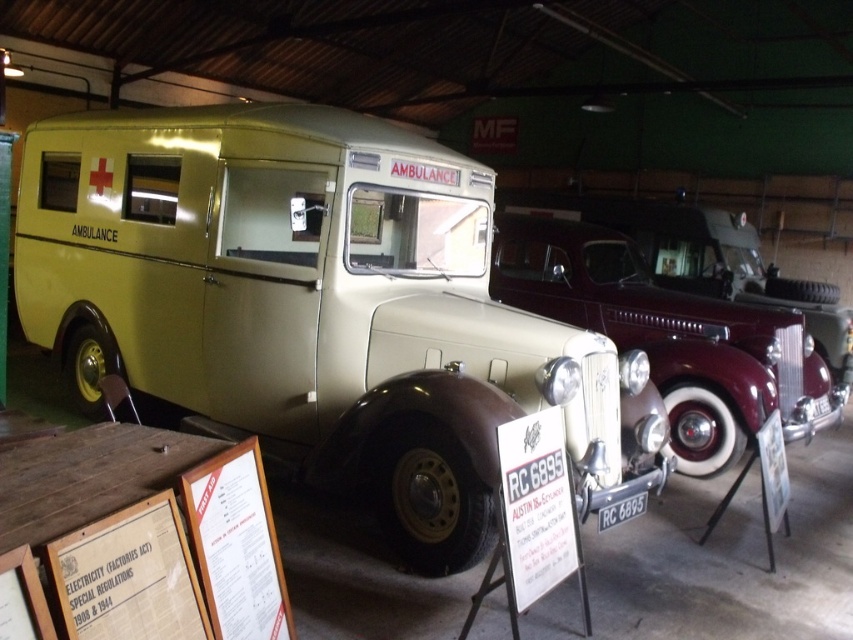
Question: Which of the following is the farthest from the observer?

Choices:
 (A) maroon glossy car at center
 (B) matte beige ambulance at center

Answer: (A)

Question: Does matte beige ambulance at center have a smaller size compared to maroon glossy car at center?

Choices:
 (A) no
 (B) yes

Answer: (A)

Question: Does matte beige ambulance at center appear under maroon glossy car at center?

Choices:
 (A) yes
 (B) no

Answer: (B)

Question: Does matte beige ambulance at center appear under maroon glossy car at center?

Choices:
 (A) yes
 (B) no

Answer: (B)

Question: Which object appears closest to the camera in this image?

Choices:
 (A) maroon glossy car at center
 (B) matte beige ambulance at center

Answer: (B)

Question: Which point is farther from the camera taking this photo?

Choices:
 (A) (254, 237)
 (B) (693, 346)

Answer: (B)